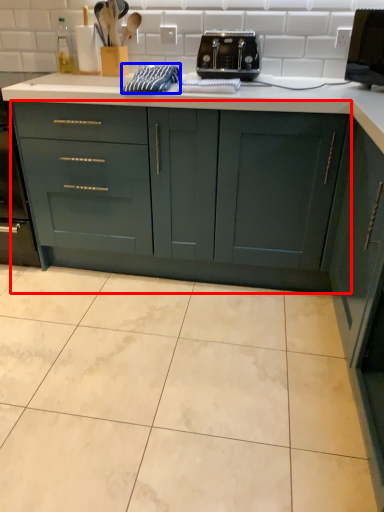
Question: Which of the following is the farthest to the observer, cabinetry (highlighted by a red box) or material (highlighted by a blue box)?

Choices:
 (A) cabinetry
 (B) material

Answer: (B)